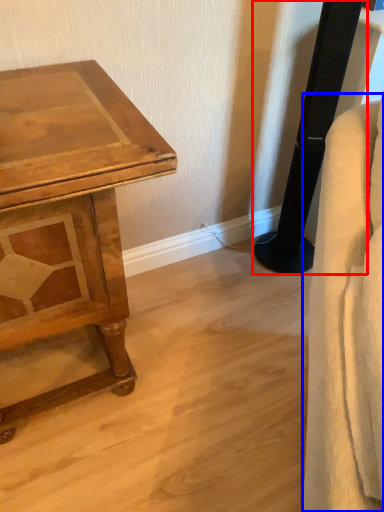
Question: Which object is further to the camera taking this photo, pillar (highlighted by a red box) or swivel chair (highlighted by a blue box)?

Choices:
 (A) pillar
 (B) swivel chair

Answer: (A)